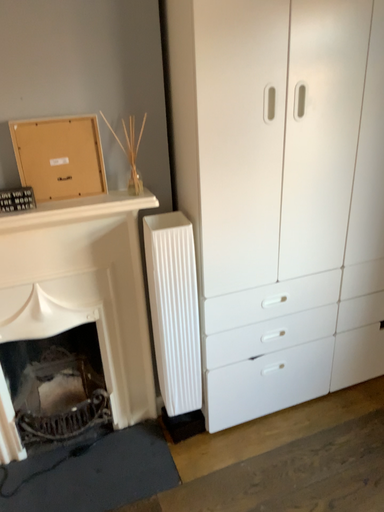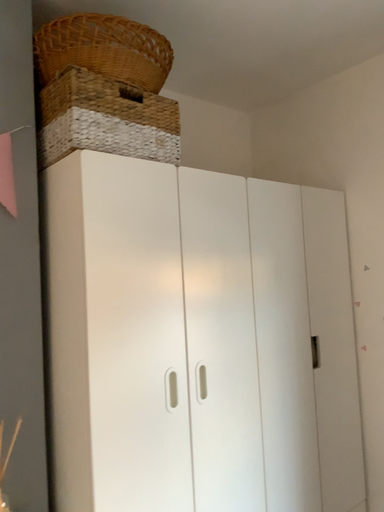
Question: How did the camera likely rotate when shooting the video?

Choices:
 (A) rotated upward
 (B) rotated downward

Answer: (A)